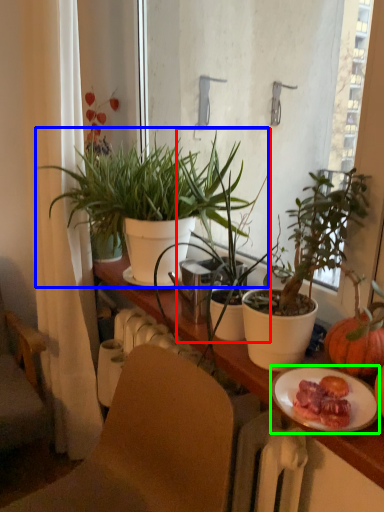
Question: Which object is positioned farthest from houseplant (highlighted by a red box)? Select from houseplant (highlighted by a blue box) and plate (highlighted by a green box).

Choices:
 (A) houseplant
 (B) plate

Answer: (B)